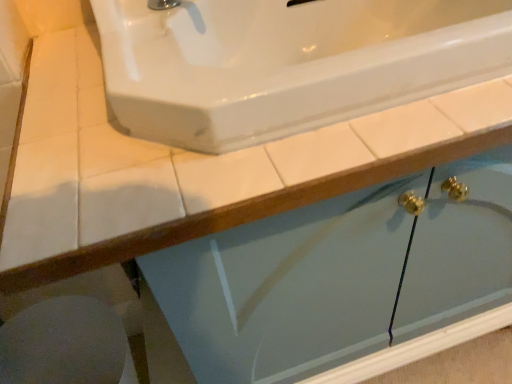
Question: Which is correct: white glossy porcelain at lower left is inside white glossy sink at upper center, or outside of it?

Choices:
 (A) outside
 (B) inside

Answer: (A)

Question: From a real-world perspective, is white glossy porcelain at lower left above or below white glossy sink at upper center?

Choices:
 (A) below
 (B) above

Answer: (A)

Question: Based on their positions, is white glossy porcelain at lower left located to the left or right of white glossy sink at upper center?

Choices:
 (A) right
 (B) left

Answer: (B)

Question: Is white glossy sink at upper center spatially inside white glossy porcelain at lower left, or outside of it?

Choices:
 (A) inside
 (B) outside

Answer: (B)

Question: Considering the positions of white glossy sink at upper center and white glossy porcelain at lower left in the image, is white glossy sink at upper center taller or shorter than white glossy porcelain at lower left?

Choices:
 (A) tall
 (B) short

Answer: (B)

Question: Relative to white glossy porcelain at lower left, is white glossy sink at upper center in front or behind?

Choices:
 (A) front
 (B) behind

Answer: (A)

Question: Is point (185, 119) positioned closer to the camera than point (71, 302)?

Choices:
 (A) farther
 (B) closer

Answer: (B)